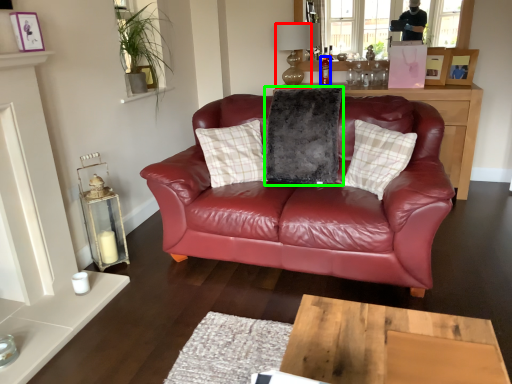
Question: Which object is the closest to the lamp (highlighted by a red box)? Choose among these: bottle (highlighted by a blue box) or pillow (highlighted by a green box).

Choices:
 (A) bottle
 (B) pillow

Answer: (A)